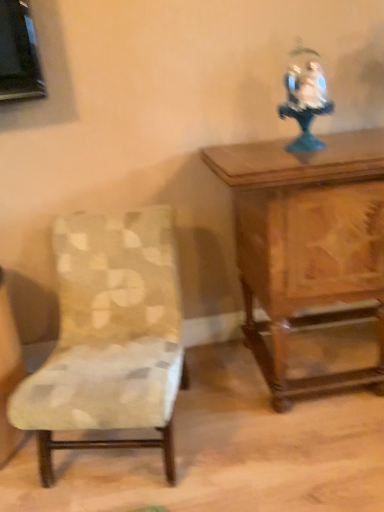
Locate an element on the screen. This screenshot has height=512, width=384. wooden carved table at upper right is located at coordinates (307, 244).

What are the coordinates of `white porcelain figurine at upper right` in the screenshot? It's located at (305, 103).

Is wooden carved table at upper right far away from white porcelain figurine at upper right?

No.

Is white porcelain figurine at upper right at the back of wooden carved table at upper right?

No.

In the scene shown: Is wooden carved table at upper right positioned beyond the bounds of white porcelain figurine at upper right?

That's correct, wooden carved table at upper right is outside of white porcelain figurine at upper right.

Who is bigger, wooden carved table at upper right or white porcelain figurine at upper right?

With larger size is wooden carved table at upper right.

What's the angular difference between patterned fabric chair at left and white porcelain figurine at upper right's facing directions?

The angular difference between patterned fabric chair at left and white porcelain figurine at upper right is 12.4 degrees.

From a real-world perspective, is patterned fabric chair at left physically below white porcelain figurine at upper right?

Yes.

The height and width of the screenshot is (512, 384). Identify the location of toy lying behind the patterned fabric chair at left. (305, 103).

Is patterned fabric chair at left far away from white porcelain figurine at upper right?

That's not correct — patterned fabric chair at left is a little close to white porcelain figurine at upper right.

Consider the image. Is wooden carved table at upper right at the back of white porcelain figurine at upper right?

No.

Based on the photo, from a real-world perspective, is white porcelain figurine at upper right over wooden carved table at upper right?

Indeed, from a real-world perspective, white porcelain figurine at upper right stands above wooden carved table at upper right.

Which object is thinner, white porcelain figurine at upper right or wooden carved table at upper right?

white porcelain figurine at upper right is thinner.

This screenshot has height=512, width=384. In order to click on table that appears below the white porcelain figurine at upper right (from a real-world perspective) in this screenshot , I will do `click(307, 244)`.

Between patterned fabric chair at left and wooden carved table at upper right, which one appears on the right side from the viewer's perspective?

Positioned to the right is wooden carved table at upper right.

From a real-world perspective, is patterned fabric chair at left located beneath wooden carved table at upper right?

Yes, from a real-world perspective, patterned fabric chair at left is beneath wooden carved table at upper right.

Which object is further away from the camera taking this photo, patterned fabric chair at left or wooden carved table at upper right?

wooden carved table at upper right is more distant.

Can you confirm if patterned fabric chair at left is shorter than wooden carved table at upper right?

Correct, patterned fabric chair at left is not as tall as wooden carved table at upper right.

Is wooden carved table at upper right in front of or behind patterned fabric chair at left in the image?

wooden carved table at upper right is behind patterned fabric chair at left.

In the scene shown: Who is shorter, wooden carved table at upper right or patterned fabric chair at left?

Standing shorter between the two is patterned fabric chair at left.

From a real-world perspective, between wooden carved table at upper right and patterned fabric chair at left, who is vertically lower?

From a 3D spatial view, patterned fabric chair at left is below.

Locate an element on the screen. chair below the wooden carved table at upper right (from a real-world perspective) is located at coordinates (110, 336).

Where is `toy that appears behind the patterned fabric chair at left`? toy that appears behind the patterned fabric chair at left is located at coordinates (305, 103).

Considering the sizes of objects white porcelain figurine at upper right and patterned fabric chair at left in the image provided, who is wider, white porcelain figurine at upper right or patterned fabric chair at left?

patterned fabric chair at left is wider.

Is point (314, 94) closer to viewer compared to point (166, 371)?

No, it is behind (166, 371).

From a real-world perspective, is white porcelain figurine at upper right physically below patterned fabric chair at left?

No, from a real-world perspective, white porcelain figurine at upper right is not under patterned fabric chair at left.

I want to click on toy behind the wooden carved table at upper right, so click(x=305, y=103).

Identify the location of chair that is under the white porcelain figurine at upper right (from a real-world perspective). The width and height of the screenshot is (384, 512). (110, 336).

From the picture: Considering their positions, is white porcelain figurine at upper right positioned closer to wooden carved table at upper right than patterned fabric chair at left?

Based on the image, white porcelain figurine at upper right appears to be nearer to wooden carved table at upper right.

Estimate the real-world distances between objects in this image. Which object is closer to white porcelain figurine at upper right, patterned fabric chair at left or wooden carved table at upper right?

Among the two, wooden carved table at upper right is located nearer to white porcelain figurine at upper right.

Considering their positions, is wooden carved table at upper right positioned closer to patterned fabric chair at left than white porcelain figurine at upper right?

wooden carved table at upper right.

Considering their positions, is patterned fabric chair at left positioned closer to wooden carved table at upper right than white porcelain figurine at upper right?

white porcelain figurine at upper right is closer to wooden carved table at upper right.

Based on their spatial positions, is white porcelain figurine at upper right or wooden carved table at upper right closer to patterned fabric chair at left?

The object closer to patterned fabric chair at left is wooden carved table at upper right.

Which object lies nearer to the anchor point white porcelain figurine at upper right, wooden carved table at upper right or patterned fabric chair at left?

wooden carved table at upper right lies closer to white porcelain figurine at upper right than the other object.

The image size is (384, 512). Identify the location of toy between patterned fabric chair at left and wooden carved table at upper right in the horizontal direction. pyautogui.click(x=305, y=103).